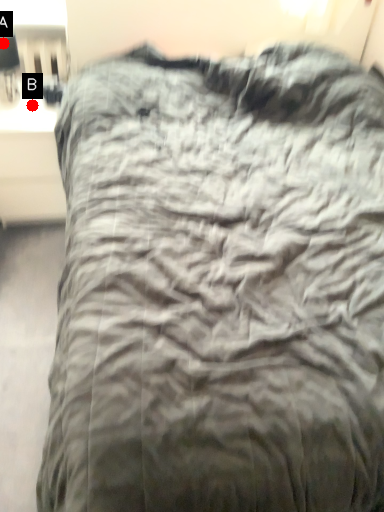
Question: Two points are circled on the image, labeled by A and B beside each circle. Which of the following is the farthest from the observer?

Choices:
 (A) A is further
 (B) B is further

Answer: (B)